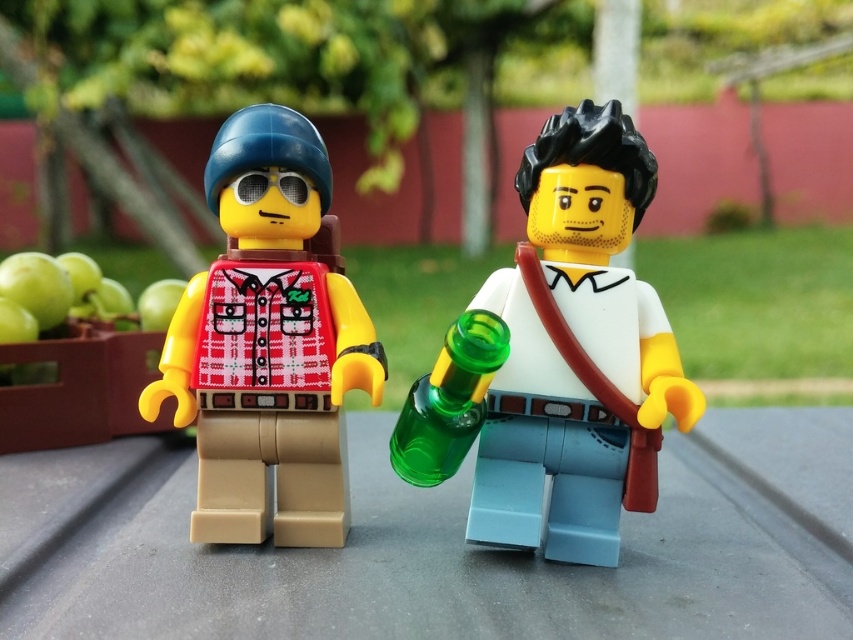
Question: Can you confirm if smooth white shirt at center is positioned to the right of matte red plaid shirt at center?

Choices:
 (A) yes
 (B) no

Answer: (A)

Question: Which point is farther from the camera taking this photo?

Choices:
 (A) (352, 372)
 (B) (474, 400)

Answer: (A)

Question: Can you confirm if smooth white shirt at center is thinner than matte red plaid shirt at center?

Choices:
 (A) no
 (B) yes

Answer: (A)

Question: Is smooth white shirt at center to the right of matte red plaid shirt at center from the viewer's perspective?

Choices:
 (A) no
 (B) yes

Answer: (B)